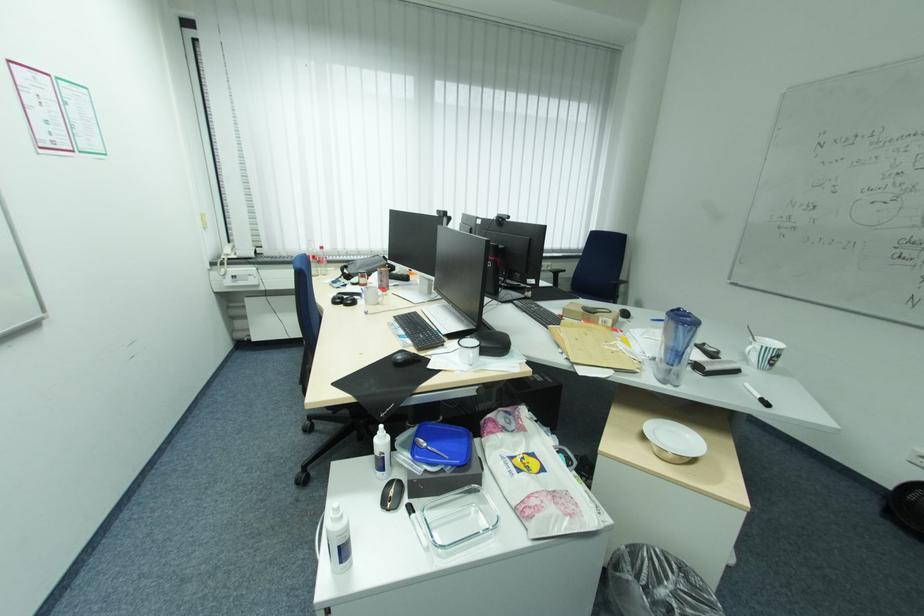
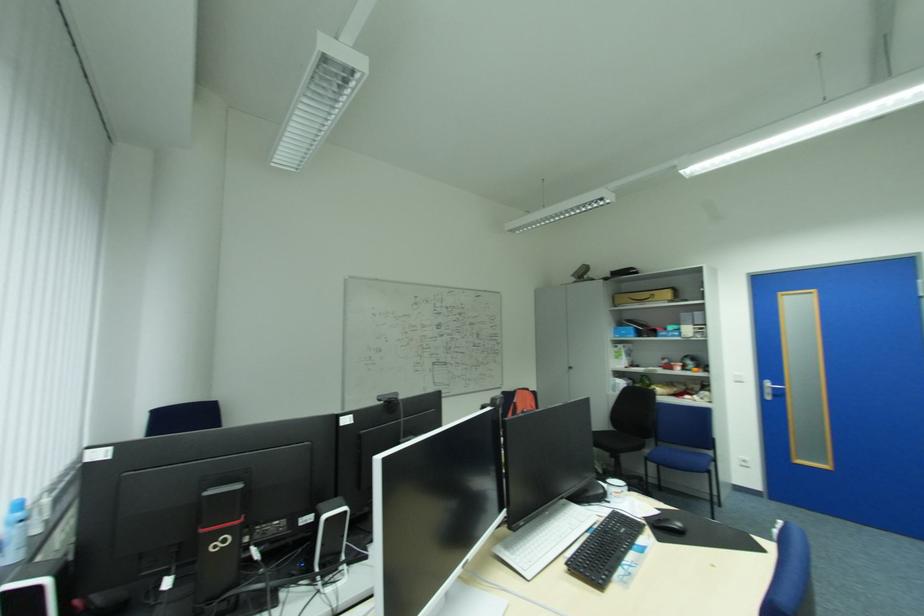
The point at (451, 306) is marked in the first image. Where is the corresponding point in the second image?

(514, 546)